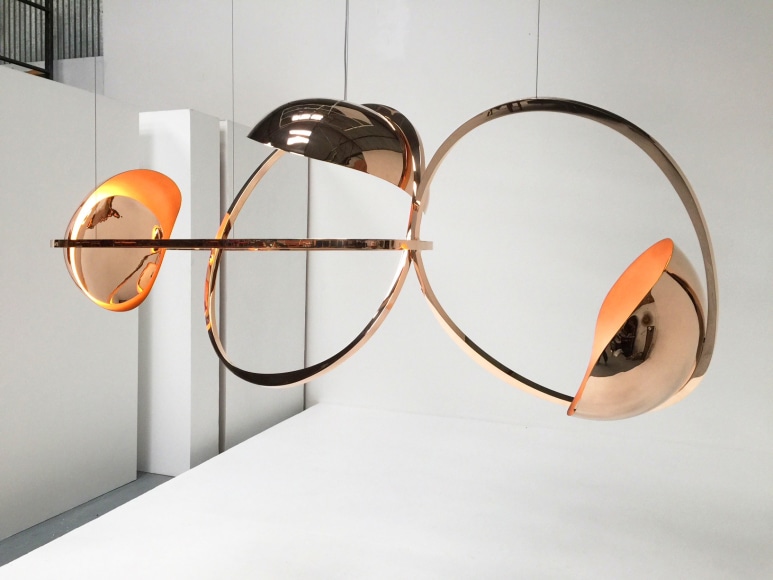
What are the coordinates of `floor` in the screenshot? It's located at (141, 485).